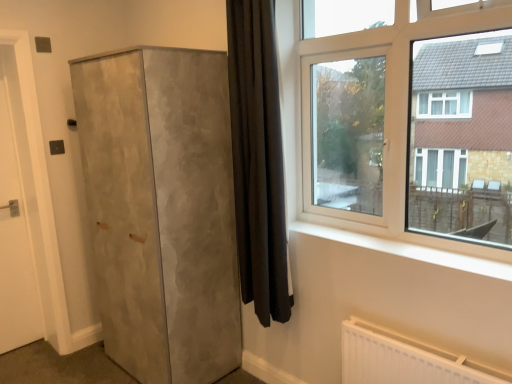
Question: Is black velvet curtain at center bigger or smaller than white matte door at left?

Choices:
 (A) small
 (B) big

Answer: (B)

Question: From a real-world perspective, is black velvet curtain at center above or below white matte door at left?

Choices:
 (A) below
 (B) above

Answer: (B)

Question: Which is farther from the clear glass window at upper right?

Choices:
 (A) matte concrete cupboard at left
 (B) black velvet curtain at center
 (C) white matte door at left

Answer: (C)

Question: Considering the real-world distances, which object is closest to the black velvet curtain at center?

Choices:
 (A) white matte door at left
 (B) clear glass window at upper right
 (C) matte concrete cupboard at left

Answer: (B)